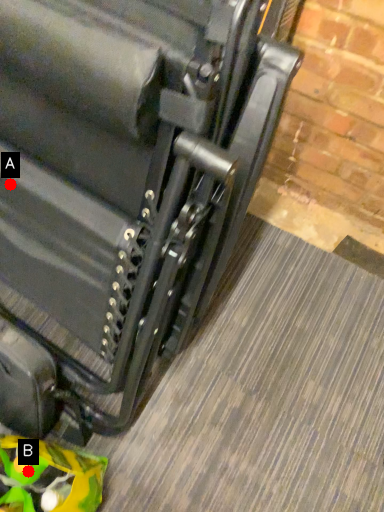
Question: Two points are circled on the image, labeled by A and B beside each circle. Which of the following is the closest to the observer?

Choices:
 (A) A is closer
 (B) B is closer

Answer: (A)